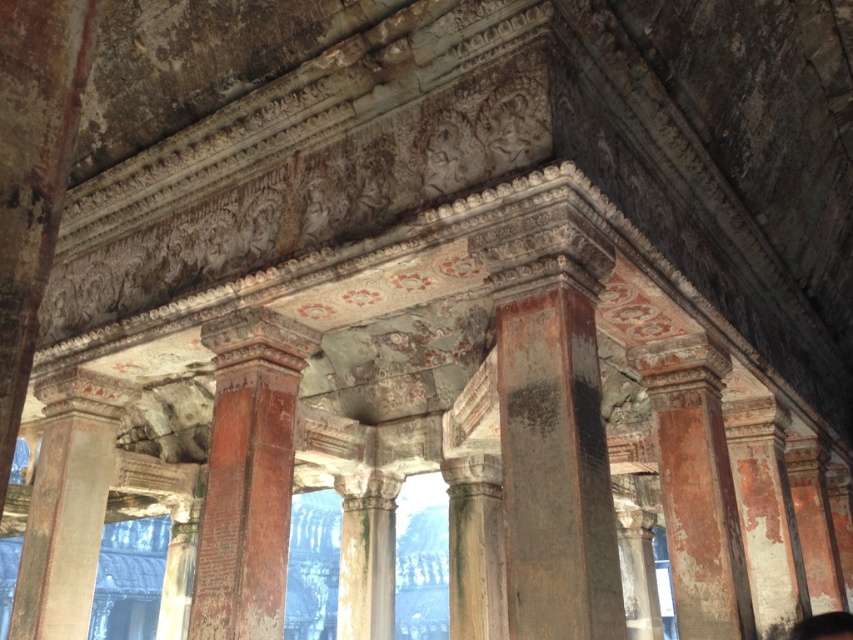
Which is more to the left, rusty metal column at center or rusty stone column at center?

rusty metal column at center

Who is higher up, rusty metal column at center or rusty stone column at center?

rusty metal column at center is above.

Describe the element at coordinates (248, 474) in the screenshot. This screenshot has width=853, height=640. I see `rusty metal column at center` at that location.

Locate an element on the screen. Image resolution: width=853 pixels, height=640 pixels. rusty metal column at center is located at coordinates (248, 474).

Measure the distance between rusty stone column at center and rustic stone column at center.

They are 8.29 meters apart.

Does rusty stone column at center appear under rustic stone column at center?

No.

Which is behind, point (679, 467) or point (358, 545)?

The point (358, 545) is more distant.

Identify the location of rusty stone column at center. (695, 484).

Who is shorter, rusty metal column at center or rustic stone column at center?

rustic stone column at center

This screenshot has height=640, width=853. What do you see at coordinates (248, 474) in the screenshot? I see `rusty metal column at center` at bounding box center [248, 474].

Where is `rusty metal column at center`? The image size is (853, 640). rusty metal column at center is located at coordinates (248, 474).